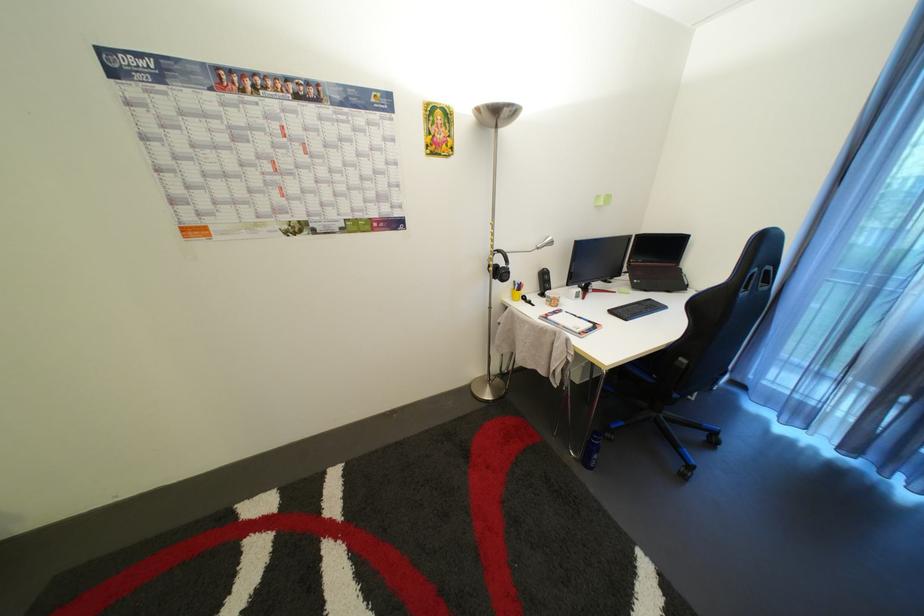
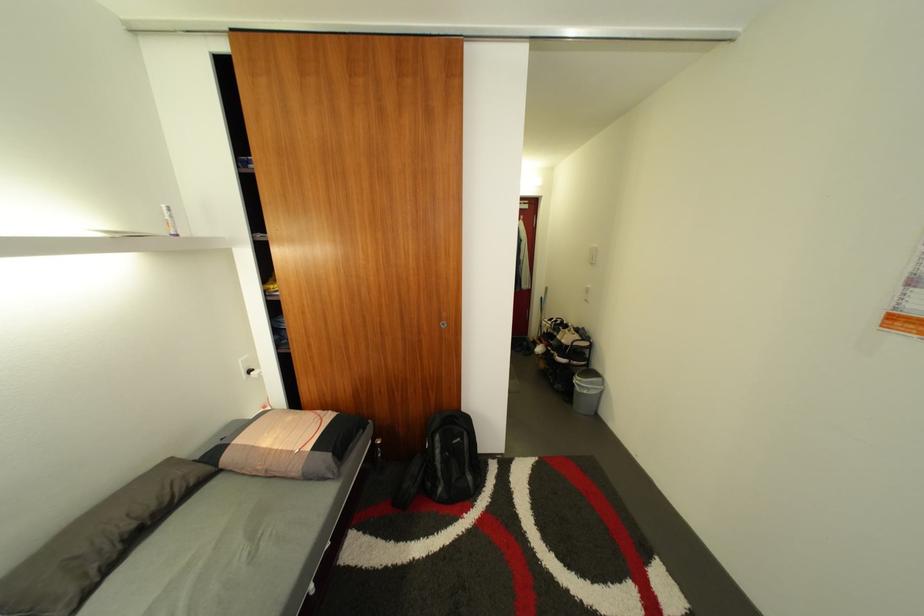
From the picture: The first image is from the beginning of the video and the second image is from the end. How did the camera likely rotate when shooting the video?

The rotation direction of the camera is left-down.